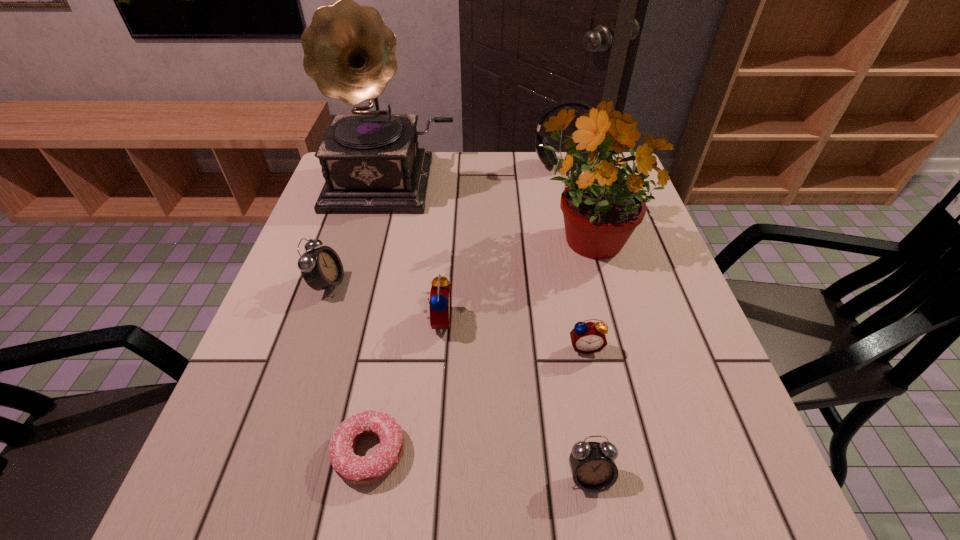
Locate an element on the screen. This screenshot has width=960, height=540. vacant space located on the face of the bigger white alarm clock is located at coordinates (513, 284).

The height and width of the screenshot is (540, 960). In order to click on free point located on the front-facing side of the third farthest alarm clock in this screenshot , I will do `click(600, 418)`.

This screenshot has width=960, height=540. Identify the location of vacant space located 0.110m on the back of the shortest object. (385, 364).

At what (x,y) coordinates should I click in order to perform the action: click on record player positioned at the far edge. Please return your answer as a coordinate pair (x, y). Image resolution: width=960 pixels, height=540 pixels. Looking at the image, I should click on (371, 161).

Image resolution: width=960 pixels, height=540 pixels. What are the coordinates of `headset positioned at the far edge` in the screenshot? It's located at (547, 157).

The image size is (960, 540). Find the location of `alarm clock that is at the near edge`. alarm clock that is at the near edge is located at coordinates (592, 464).

Identify the location of doughnut that is at the near edge. This screenshot has width=960, height=540. (354, 469).

Find the location of `record player that is positioned at the left edge`. record player that is positioned at the left edge is located at coordinates (371, 161).

Locate an element on the screen. The height and width of the screenshot is (540, 960). alarm clock at the left edge is located at coordinates (321, 268).

Where is `flowerpot present at the right edge`? The width and height of the screenshot is (960, 540). flowerpot present at the right edge is located at coordinates pyautogui.click(x=601, y=206).